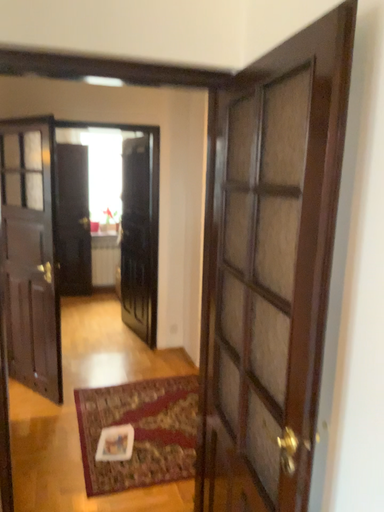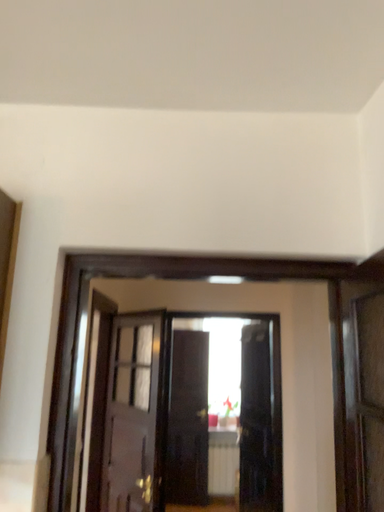
Question: Which way did the camera rotate in the video?

Choices:
 (A) rotated right
 (B) rotated left

Answer: (B)